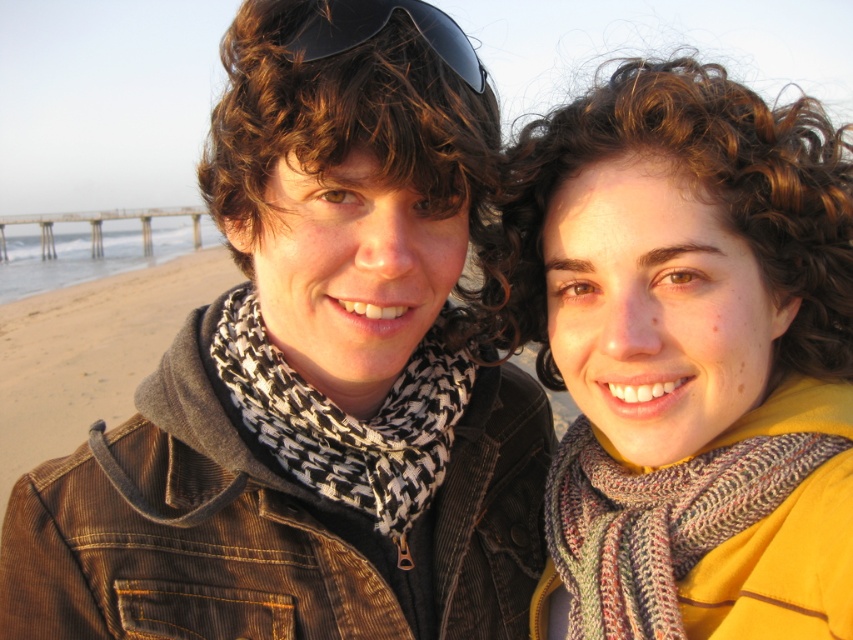
Question: Does houndstooth knitted scarf at center come behind black matte sunglasses at upper center?

Choices:
 (A) yes
 (B) no

Answer: (A)

Question: Which is nearer to the knitted scarf at center?

Choices:
 (A) black matte sunglasses at upper center
 (B) knitted multicolored scarf at right
 (C) houndstooth knitted scarf at center

Answer: (B)

Question: From the image, what is the correct spatial relationship of knitted scarf at center in relation to knitted multicolored scarf at right?

Choices:
 (A) left
 (B) right

Answer: (B)

Question: Can you confirm if knitted multicolored scarf at right is positioned to the right of houndstooth knitted scarf at center?

Choices:
 (A) no
 (B) yes

Answer: (B)

Question: Which of the following is the farthest from the observer?

Choices:
 (A) black matte sunglasses at upper center
 (B) knitted multicolored scarf at right
 (C) knitted scarf at center
 (D) houndstooth knitted scarf at center

Answer: (D)

Question: Which object is closer to the camera taking this photo?

Choices:
 (A) black matte sunglasses at upper center
 (B) houndstooth knitted scarf at center
 (C) knitted scarf at center
 (D) knitted multicolored scarf at right

Answer: (D)